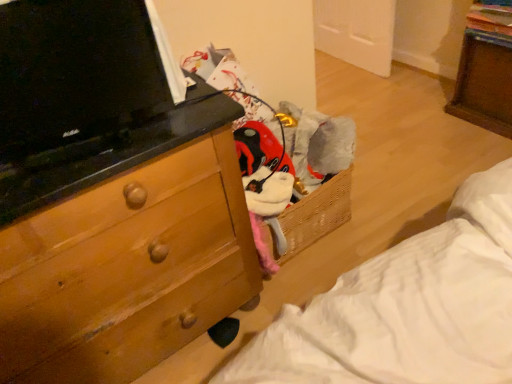
Question: Can you confirm if wooden chest of drawers at left is wider than black glossy tv at upper left?

Choices:
 (A) no
 (B) yes

Answer: (B)

Question: Is wooden chest of drawers at left closer to camera compared to black glossy tv at upper left?

Choices:
 (A) no
 (B) yes

Answer: (B)

Question: Is wooden chest of drawers at left behind black glossy tv at upper left?

Choices:
 (A) no
 (B) yes

Answer: (A)

Question: Can you confirm if wooden chest of drawers at left is thinner than black glossy tv at upper left?

Choices:
 (A) yes
 (B) no

Answer: (B)

Question: Is wooden chest of drawers at left positioned with its back to black glossy tv at upper left?

Choices:
 (A) no
 (B) yes

Answer: (A)

Question: From a real-world perspective, is wooden chest of drawers at left below black glossy tv at upper left?

Choices:
 (A) no
 (B) yes

Answer: (B)

Question: Is black glossy tv at upper left bigger than wooden chest of drawers at left?

Choices:
 (A) no
 (B) yes

Answer: (A)

Question: Does black glossy tv at upper left have a greater width compared to wooden chest of drawers at left?

Choices:
 (A) no
 (B) yes

Answer: (A)

Question: From a real-world perspective, is black glossy tv at upper left physically below wooden chest of drawers at left?

Choices:
 (A) yes
 (B) no

Answer: (B)

Question: Could wooden chest of drawers at left be considered to be inside black glossy tv at upper left?

Choices:
 (A) yes
 (B) no

Answer: (B)

Question: Can you confirm if black glossy tv at upper left is thinner than wooden chest of drawers at left?

Choices:
 (A) no
 (B) yes

Answer: (B)

Question: Is black glossy tv at upper left taller than wooden chest of drawers at left?

Choices:
 (A) yes
 (B) no

Answer: (B)

Question: Relative to wooden chest of drawers at left, is black glossy tv at upper left in front or behind?

Choices:
 (A) front
 (B) behind

Answer: (B)